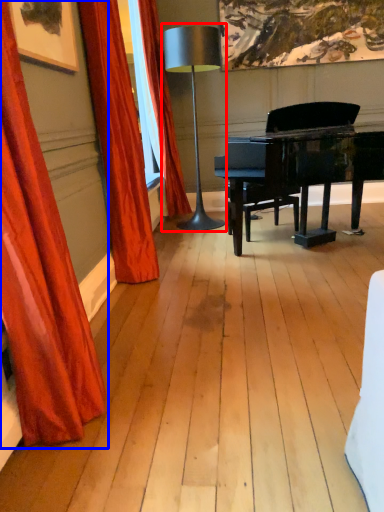
Question: Among these objects, which one is nearest to the camera, table lamp (highlighted by a red box) or curtain (highlighted by a blue box)?

Choices:
 (A) table lamp
 (B) curtain

Answer: (B)